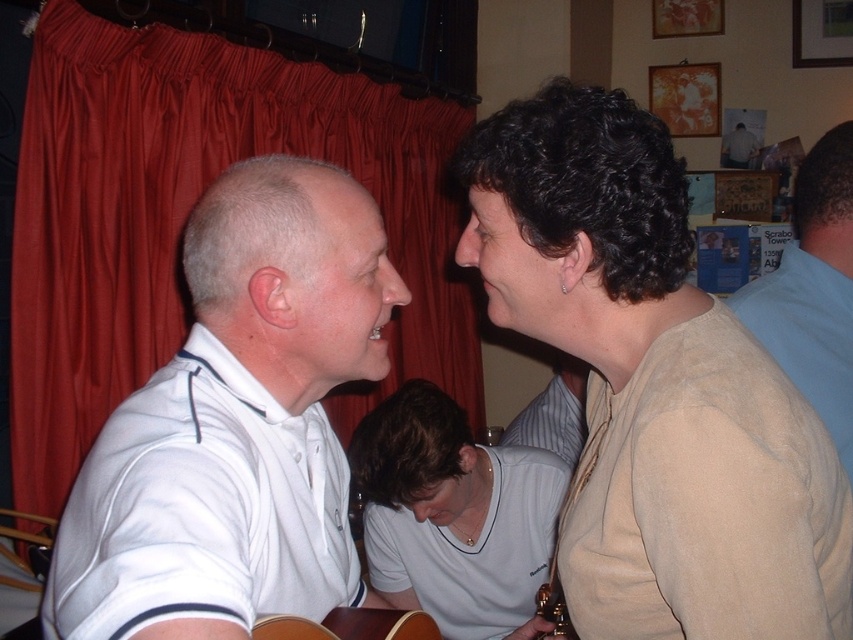
Between white matte shirt at left and blue cotton shirt at upper right, which one has more height?

blue cotton shirt at upper right

Who is more forward, (310,332) or (747,298)?

Positioned in front is point (310,332).

This screenshot has width=853, height=640. I want to click on white matte shirt at left, so 235,422.

Based on the photo, can you confirm if beige soft sweater at upper right is positioned to the right of white shirt at upper center?

Incorrect, beige soft sweater at upper right is not on the right side of white shirt at upper center.

Who is taller, beige soft sweater at upper right or white shirt at upper center?

beige soft sweater at upper right is taller.

Identify the location of beige soft sweater at upper right. Image resolution: width=853 pixels, height=640 pixels. (653, 387).

Can you confirm if light brown wooden guitar at center is wider than white shirt at upper center?

Indeed, light brown wooden guitar at center has a greater width compared to white shirt at upper center.

Which is more to the left, light brown wooden guitar at center or white shirt at upper center?

light brown wooden guitar at center is more to the left.

Describe the element at coordinates (349, 625) in the screenshot. Image resolution: width=853 pixels, height=640 pixels. I see `light brown wooden guitar at center` at that location.

This screenshot has height=640, width=853. Find the location of `light brown wooden guitar at center`. light brown wooden guitar at center is located at coordinates (349, 625).